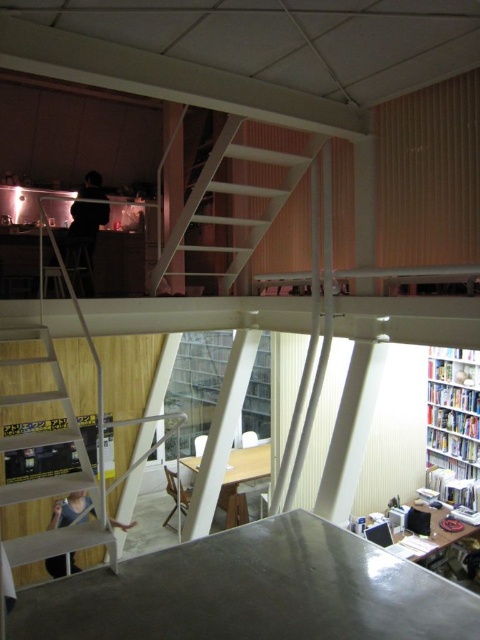
Question: Does wooden staircase at lower left come in front of white glossy bookshelf at right?

Choices:
 (A) yes
 (B) no

Answer: (A)

Question: Which of these objects is positioned closest to the white metal ladder at center?

Choices:
 (A) wooden staircase at lower left
 (B) white glossy bookshelf at right

Answer: (A)

Question: Which point is farther to the camera?

Choices:
 (A) white glossy bookshelf at right
 (B) wooden staircase at lower left

Answer: (A)

Question: Which point is closer to the camera?

Choices:
 (A) (442, 401)
 (B) (153, 273)
 (C) (0, 493)

Answer: (C)

Question: Is wooden staircase at lower left above white glossy bookshelf at right?

Choices:
 (A) yes
 (B) no

Answer: (A)

Question: Is white metal ladder at center wider than wooden staircase at lower left?

Choices:
 (A) yes
 (B) no

Answer: (A)